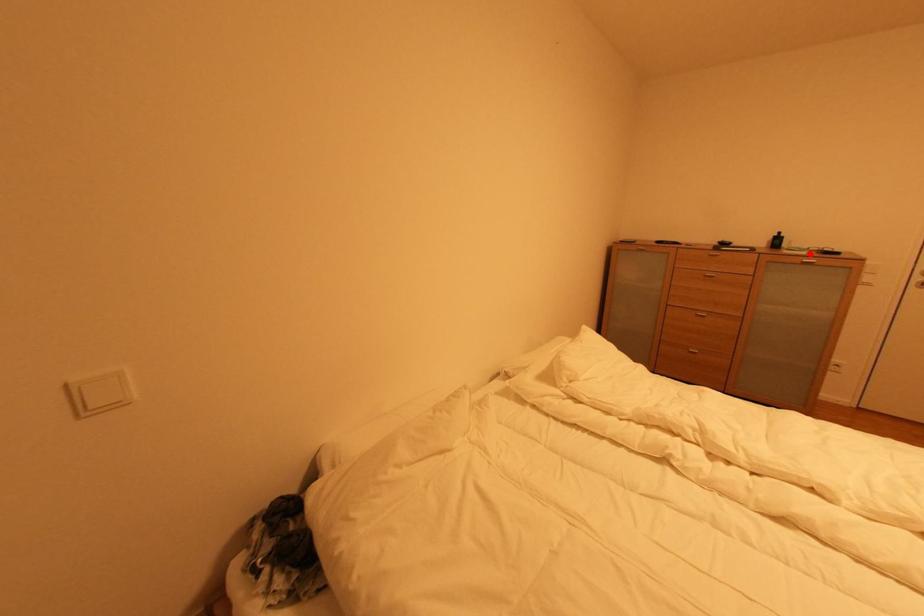
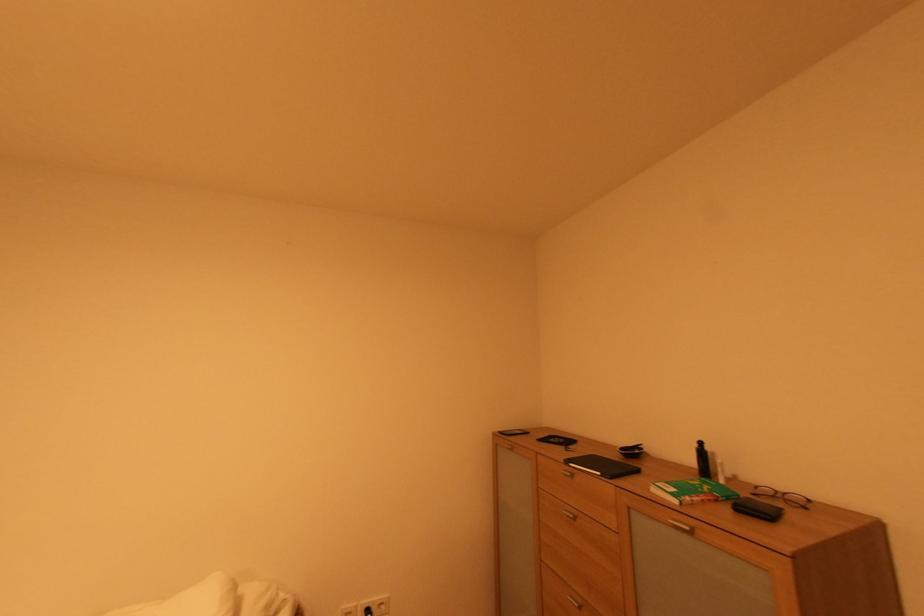
Where in the second image is the point corresponding to the highlighted location from the first image?

(682, 503)